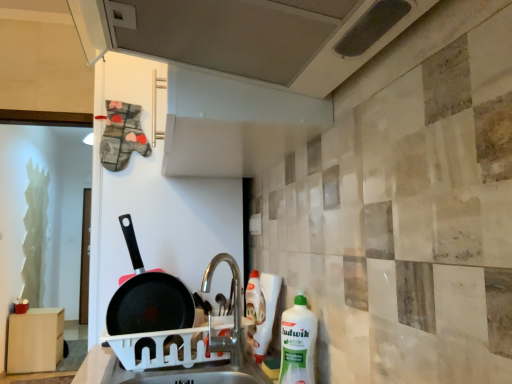
Question: Can you confirm if white plastic dish rack at sink is thinner than black non-stick frying pan at center?

Choices:
 (A) no
 (B) yes

Answer: (A)

Question: Is white plastic dish rack at sink not within black non-stick frying pan at center?

Choices:
 (A) yes
 (B) no

Answer: (A)

Question: Does white plastic dish rack at sink touch black non-stick frying pan at center?

Choices:
 (A) no
 (B) yes

Answer: (A)

Question: Considering the relative positions of white plastic dish rack at sink and black non-stick frying pan at center in the image provided, is white plastic dish rack at sink to the left of black non-stick frying pan at center from the viewer's perspective?

Choices:
 (A) yes
 (B) no

Answer: (B)

Question: From a real-world perspective, is white plastic dish rack at sink beneath black non-stick frying pan at center?

Choices:
 (A) yes
 (B) no

Answer: (A)

Question: Is black non-stick frying pan at center at the back of white plastic dish rack at sink?

Choices:
 (A) yes
 (B) no

Answer: (B)

Question: From a real-world perspective, is white plastic sink at center physically below white plastic bottle at right?

Choices:
 (A) no
 (B) yes

Answer: (B)

Question: Is white plastic sink at center positioned in front of white plastic bottle at right?

Choices:
 (A) no
 (B) yes

Answer: (A)

Question: Are white plastic sink at center and white plastic bottle at right beside each other?

Choices:
 (A) no
 (B) yes

Answer: (A)

Question: Does white plastic sink at center turn towards white plastic bottle at right?

Choices:
 (A) yes
 (B) no

Answer: (B)

Question: From a real-world perspective, does white plastic sink at center stand above white plastic bottle at right?

Choices:
 (A) yes
 (B) no

Answer: (B)

Question: Is white plastic sink at center at the left side of white plastic bottle at right?

Choices:
 (A) yes
 (B) no

Answer: (A)

Question: Is metallic perforated exhaust hood at upper center a part of white plastic sink at center?

Choices:
 (A) yes
 (B) no

Answer: (B)